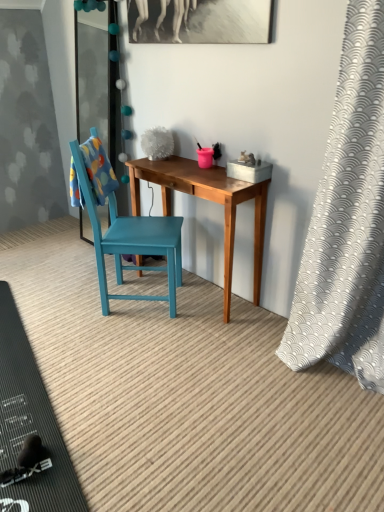
Question: Considering the positions of white textured curtain at right and black rubber mat at lower left in the image, is white textured curtain at right wider or thinner than black rubber mat at lower left?

Choices:
 (A) wide
 (B) thin

Answer: (B)

Question: Considering their positions, is white textured curtain at right located in front of or behind black rubber mat at lower left?

Choices:
 (A) behind
 (B) front

Answer: (B)

Question: Considering the real-world distances, which object is farthest from the white textured curtain at right?

Choices:
 (A) teal wooden chair at center
 (B) wooden desk at center
 (C) black rubber mat at lower left

Answer: (C)

Question: Which object is the closest to the white textured curtain at right?

Choices:
 (A) wooden desk at center
 (B) black rubber mat at lower left
 (C) teal wooden chair at center

Answer: (A)